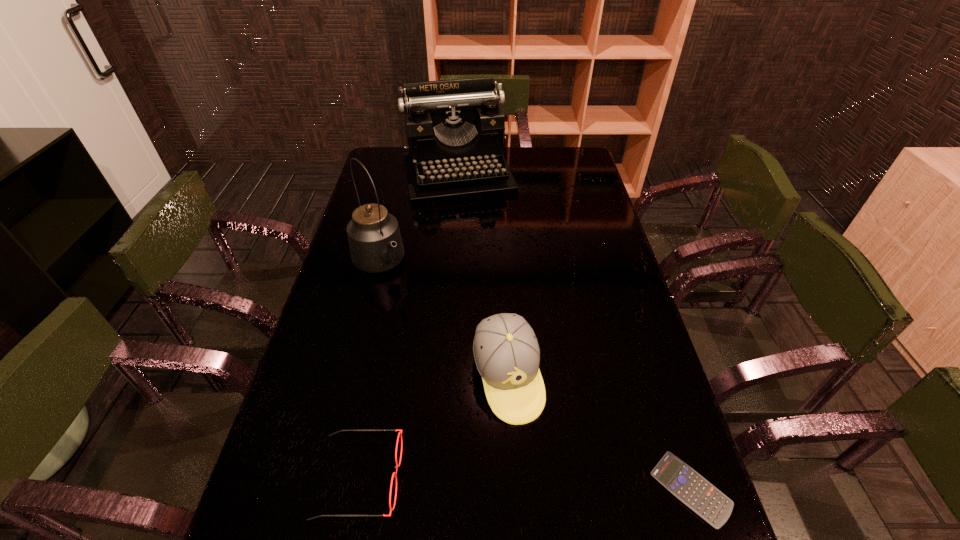
You are a GUI agent. You are given a task and a screenshot of the screen. Output one action in this format:
    pyautogui.click(x=<x>, y=<y>)
    Task: Click on the blank area located 0.200m on the front-facing side of the baseball cap
    This screenshot has width=960, height=540.
    Given the screenshot: What is the action you would take?
    pyautogui.click(x=548, y=514)

Identify the location of vacant space located 0.120m on the front-facing side of the baseball cap. (535, 475).

You are a GUI agent. You are given a task and a screenshot of the screen. Output one action in this format:
    pyautogui.click(x=<x>, y=<y>)
    Task: Click on the vacant space situated 0.140m spout on the second farthest object
    The height and width of the screenshot is (540, 960).
    Given the screenshot: What is the action you would take?
    pyautogui.click(x=415, y=310)

The image size is (960, 540). I want to click on vacant area situated spout on the second farthest object, so click(443, 343).

At what (x,y) coordinates should I click in order to perform the action: click on free location located 0.350m spout on the second farthest object. Please return your answer as a coordinate pair (x, y). Looking at the image, I should click on (455, 357).

Find the location of a particular element. This screenshot has width=960, height=540. vacant space located on the typing side of the typewriter is located at coordinates (470, 213).

This screenshot has height=540, width=960. In order to click on free space located on the typing side of the typewriter in this screenshot , I will do `click(470, 214)`.

Where is `vacant space situated 0.400m on the typing side of the typewriter`? vacant space situated 0.400m on the typing side of the typewriter is located at coordinates (491, 277).

Locate an element on the screen. object situated at the far edge is located at coordinates (455, 129).

I want to click on spectacles that is at the near edge, so click(x=394, y=474).